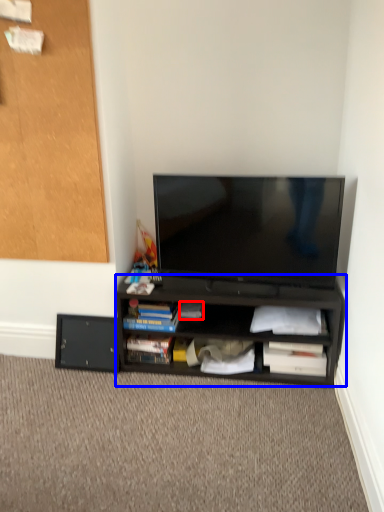
Question: Which of the following is the closest to the observer, book (highlighted by a red box) or desk (highlighted by a blue box)?

Choices:
 (A) book
 (B) desk

Answer: (B)